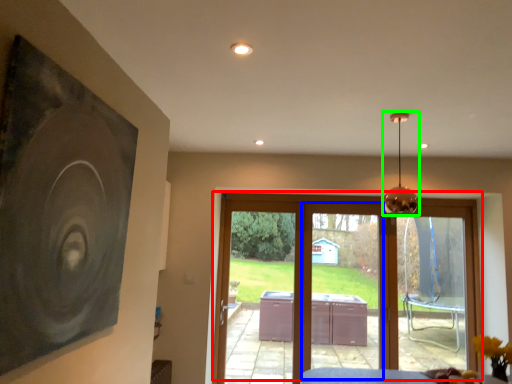
Question: Considering the real-world distances, which object is closest to door (highlighted by a red box)? screen door (highlighted by a blue box) or lamp (highlighted by a green box).

Choices:
 (A) screen door
 (B) lamp

Answer: (A)